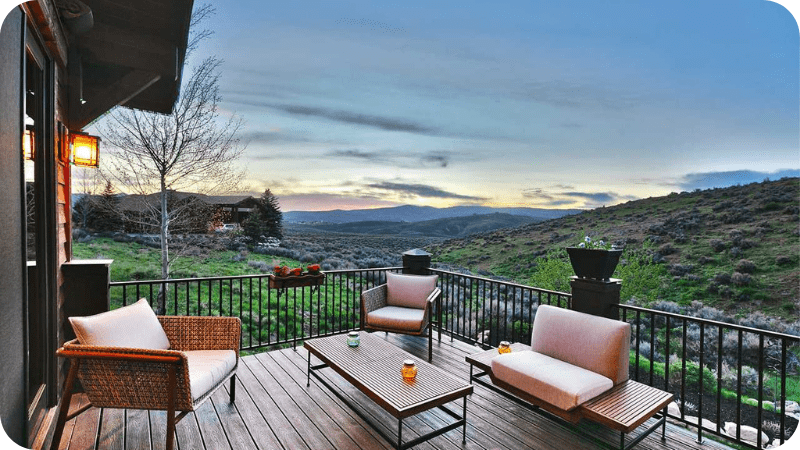
This screenshot has width=800, height=450. Find the location of `chair`. chair is located at coordinates (208, 371), (401, 320), (549, 392).